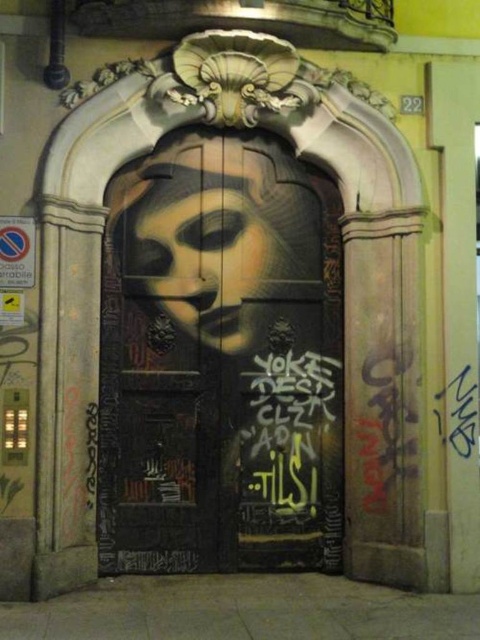
You are standing in front of the door and want to place a small decorative plaque exactly at the center of the matte black door at center. According to the coordinates provided, where should you place it?

The center of the matte black door at center is located at coordinates point (220,360), so you should place the plaque there.

You are standing in front of the door and want to touch the matte black door at center and the black graffiti at center. Which one can you reach without moving your hand too far?

The matte black door at center is closer to you than the black graffiti at center, so you can reach it without moving your hand too far.